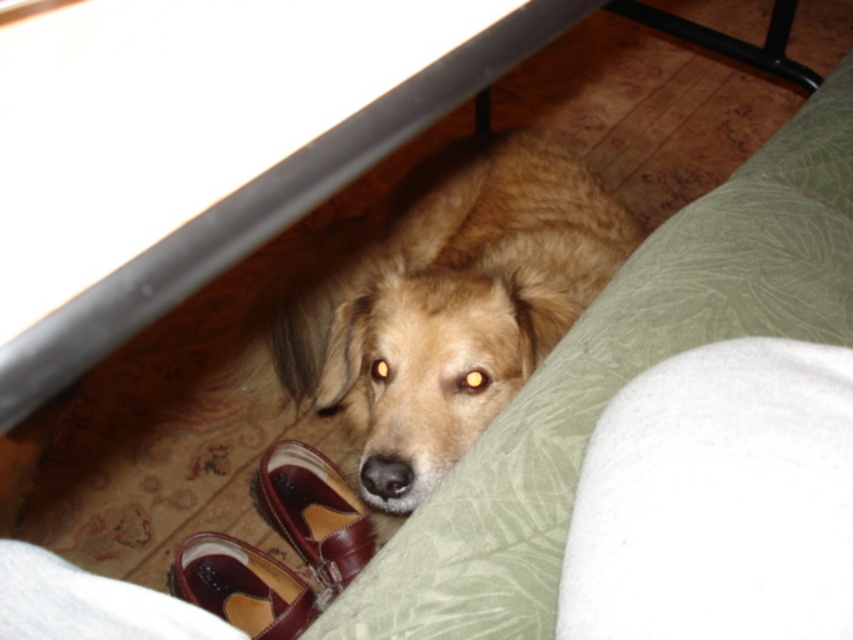
You are standing in the room and want to pick up an object located at point (271, 348). Can you reach it without moving your feet?

The point (271, 348) is 1.42 meters away from you, so you can reach it without moving your feet since it is within arm reach.

You are a delivery person entering the house and see the golden fur dog at center and the brown leather shoe at lower center. Which object is closer to the entrance?

The golden fur dog at center is closer to the entrance because it is located above the brown leather shoe at lower center, which is further away from the entrance.

You are a robot vacuum cleaner with a 12 inch diameter. You need to move from the golden fur dog at center to the brown leather shoe at lower center. Can you navigate the space between them without hitting anything?

The distance between the golden fur dog at center and the brown leather shoe at lower center is 11.28 inches. Since your diameter is 12 inches, you cannot fit through the space as the distance is less than your size.